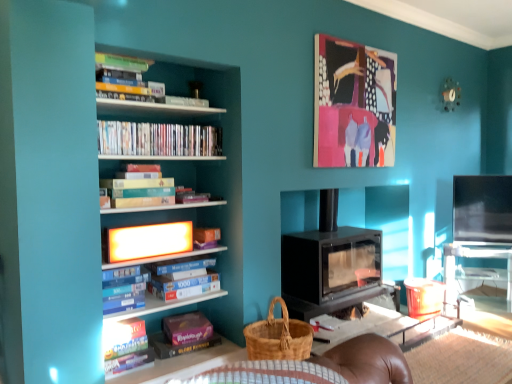
Question: In the image, is black matte wood burning stove at center on the left side or the right side of matte cardboard book at lower left, positioned as the 5th book in top-to-bottom order?

Choices:
 (A) left
 (B) right

Answer: (B)

Question: Is black matte wood burning stove at center wider or thinner than matte cardboard book at lower left, positioned as the 5th book in top-to-bottom order?

Choices:
 (A) thin
 (B) wide

Answer: (B)

Question: Estimate the real-world distances between objects in this image. Which object is closer to the bright orange plastic shelf at upper center?

Choices:
 (A) matte cardboard book at lower left, which is counted as the first book, starting from the bottom
 (B) white glossy bookshelf at left
 (C) blue cardboard puzzle at upper left, the third book when ordered from top to bottom
 (D) abstract painting at upper center
 (E) hardcover books at center, the fourth book positioned from the bottom

Answer: (E)

Question: Which object is positioned farthest from the white glossy bookshelf at left?

Choices:
 (A) hardcover books at center, which ranks as the second book in top-to-bottom order
 (B) abstract painting at upper center
 (C) matte cardboard book at lower left, which is counted as the first book, starting from the bottom
 (D) blue cardboard puzzle at upper left, the third book when ordered from top to bottom
 (E) transparent plastic table at right

Answer: (E)